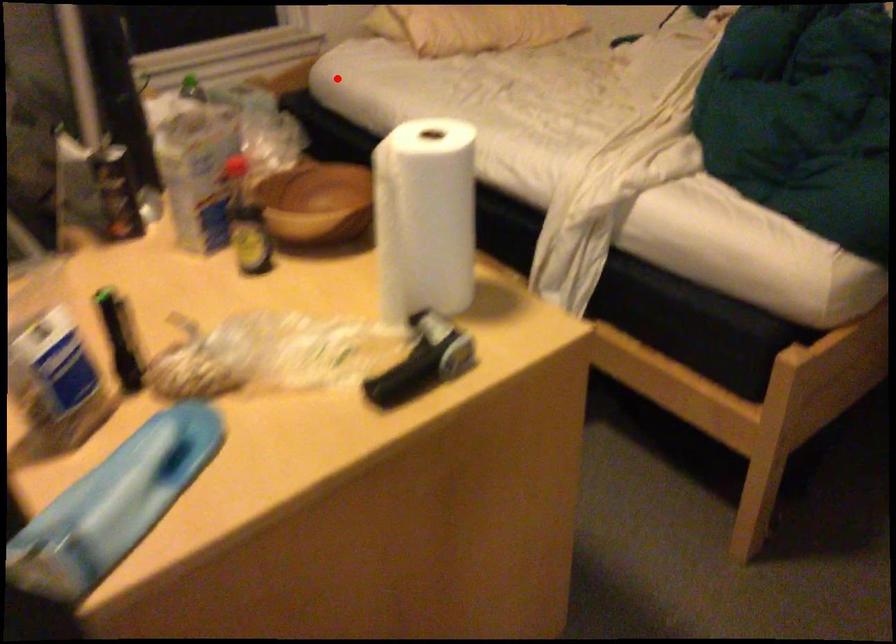
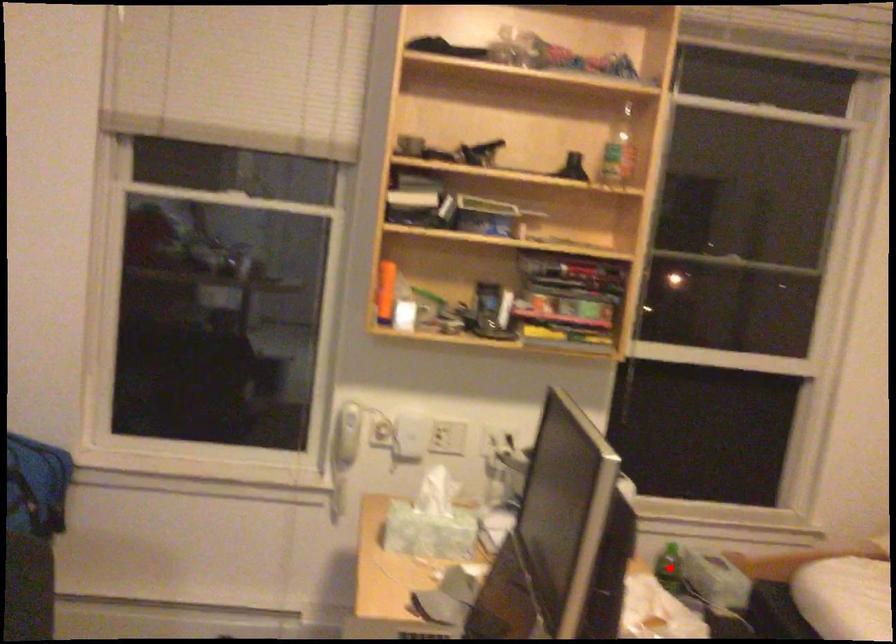
I am providing you with two images of the same scene from different viewpoints. A red point is marked on the first image and another point is marked on the second image. Are the points marked in image1 and image2 representing the same 3D position?

No